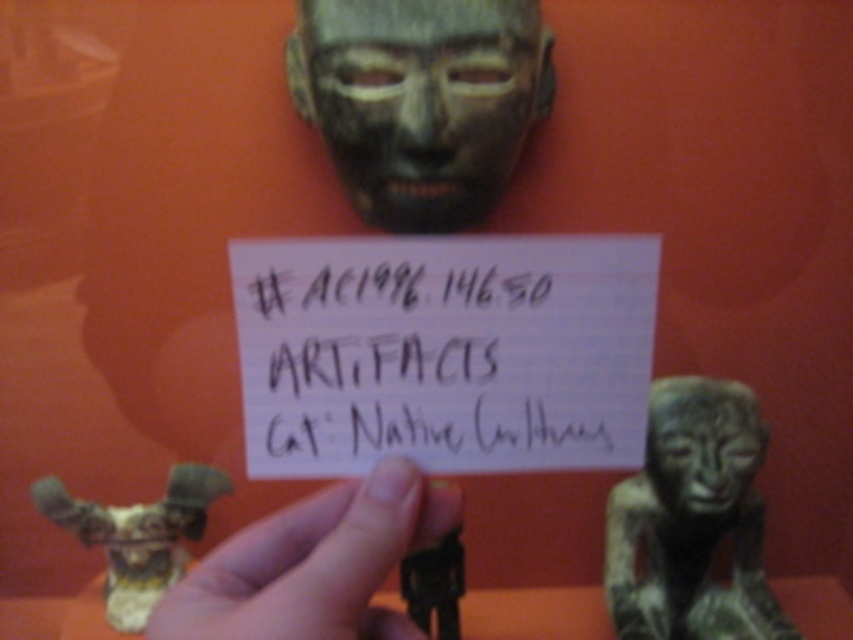
You are an archaeologist examining the artifacts displayed against the vibrant orange background. You notice the black paper at center and the matte bronze figure at center. Which object takes up more space in the image?

The matte bronze figure at center occupies more space than the black paper at center, as stated in the objects description.

You are an archaeologist examining the artifacts displayed against the vibrant orange background. You notice two points labeled in the image. Which point is closer to you, point (456, 80) or point (167, 621)?

Point (456, 80) is closer to the viewer than point (167, 621).